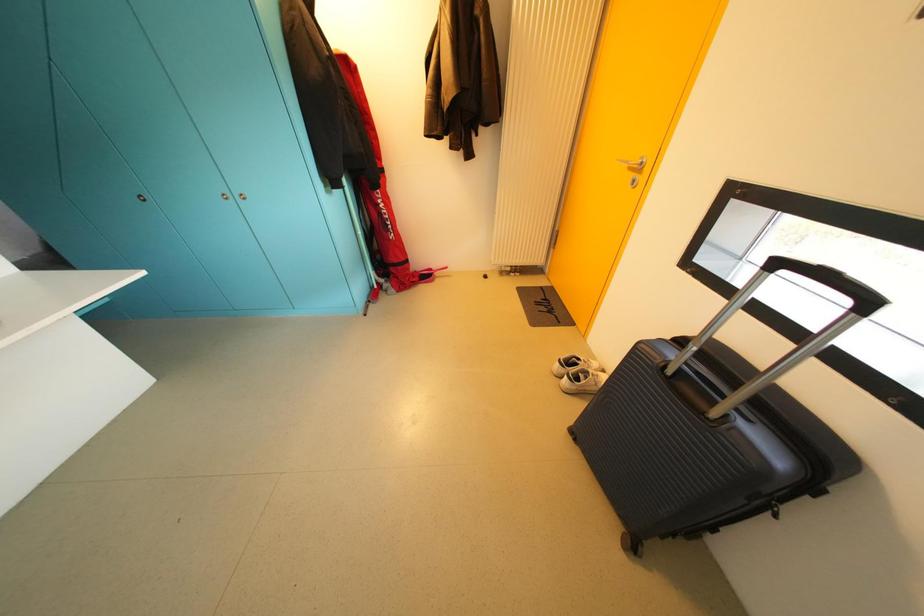
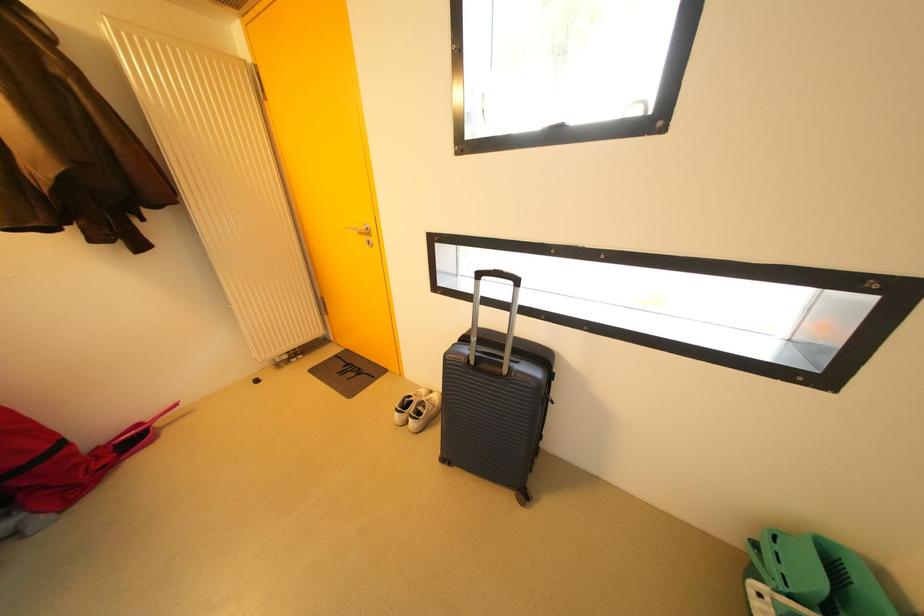
Question: The images are taken continuously from a first-person perspective. In which direction is your viewpoint rotating?

Choices:
 (A) Left
 (B) Right
 (C) Up
 (D) Down

Answer: (B)